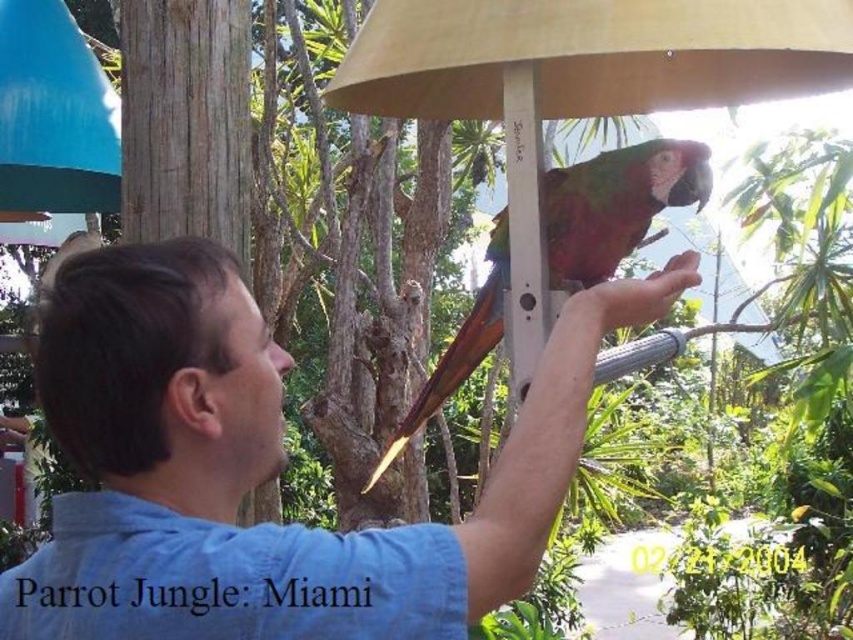
You are a photographer positioned in front of the scene at Parrot Jungle in Miami. You want to take a clear photo of the green matte parrot at center without the blue cotton shirt at center blocking the view. Can you adjust your position to achieve this?

The blue cotton shirt at center is closer to the viewer than the green matte parrot at center, so moving your position slightly to the side or adjusting the angle might help to avoid the obstruction caused by the blue cotton shirt at center.

You are a visitor at Parrot Jungle in Miami and see the blue cotton shirt at center and the green matte parrot at center. Which object is positioned more to the left?

The green matte parrot at center is positioned more to the left than the blue cotton shirt at center because the blue cotton shirt at center is to the right of green matte parrot at center.